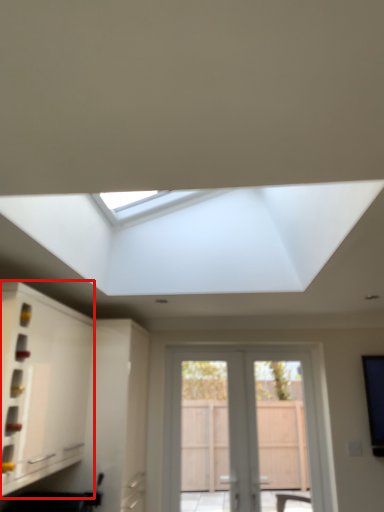
Question: From the image's perspective, considering the relative positions of cabinetry (annotated by the red box) and door in the image provided, where is cabinetry (annotated by the red box) located with respect to the staircase?

Choices:
 (A) above
 (B) below

Answer: (A)